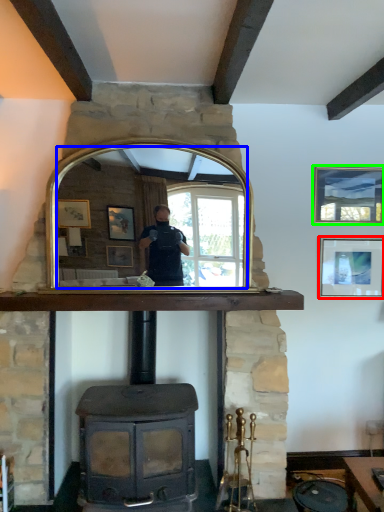
Question: Which object is positioned closest to picture frame (highlighted by a red box)? Select from mirror (highlighted by a blue box) and picture frame (highlighted by a green box).

Choices:
 (A) mirror
 (B) picture frame

Answer: (B)